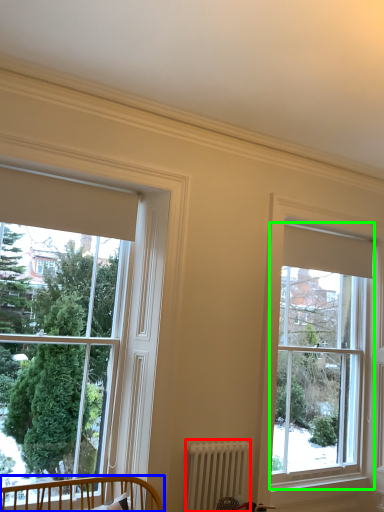
Question: Which object is the closest to the radiator (highlighted by a red box)? Choose among these: furniture (highlighted by a blue box) or window (highlighted by a green box).

Choices:
 (A) furniture
 (B) window

Answer: (A)